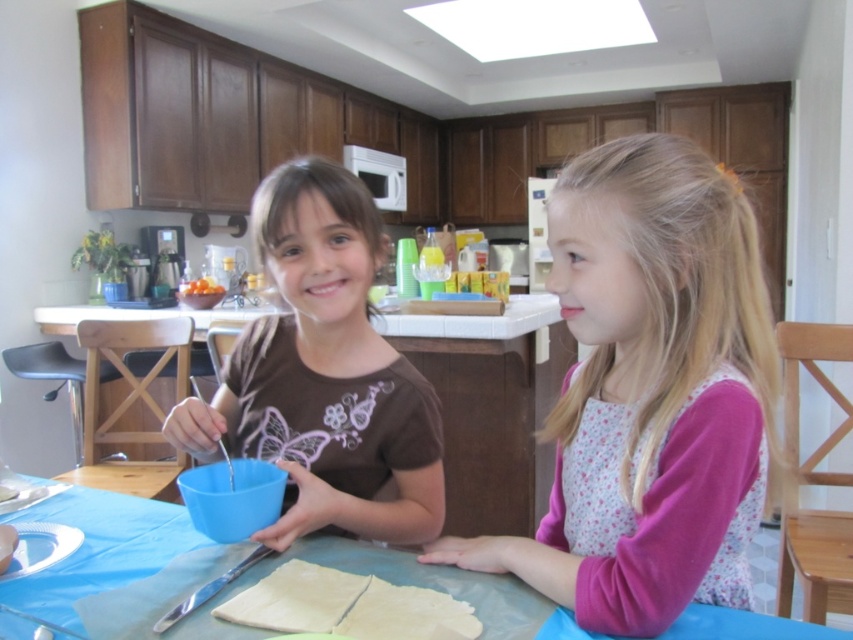
Describe the element at coordinates (323, 374) in the screenshot. I see `matte brown shirt at center` at that location.

Does point (344, 292) lie in front of point (212, 289)?

Yes, it is.

Identify the location of matte brown shirt at center. (323, 374).

Is point (611, 209) positioned behind point (560, 356)?

No, (611, 209) is in front of (560, 356).

Can you confirm if floral fabric dress at center is positioned above blue plastic bowl at center?

Indeed, floral fabric dress at center is positioned over blue plastic bowl at center.

Does point (675, 592) come behind point (524, 408)?

No, (675, 592) is in front of (524, 408).

This screenshot has height=640, width=853. In order to click on floral fabric dress at center in this screenshot , I will do `click(648, 392)`.

Can you confirm if matte brown shirt at center is positioned above blue plastic bowl at center?

Indeed, matte brown shirt at center is positioned over blue plastic bowl at center.

Does matte brown shirt at center have a greater width compared to blue plastic bowl at center?

No.

Who is more forward, (363, 436) or (132, 316)?

Point (363, 436) is in front.

Locate an element on the screen. The image size is (853, 640). matte brown shirt at center is located at coordinates (323, 374).